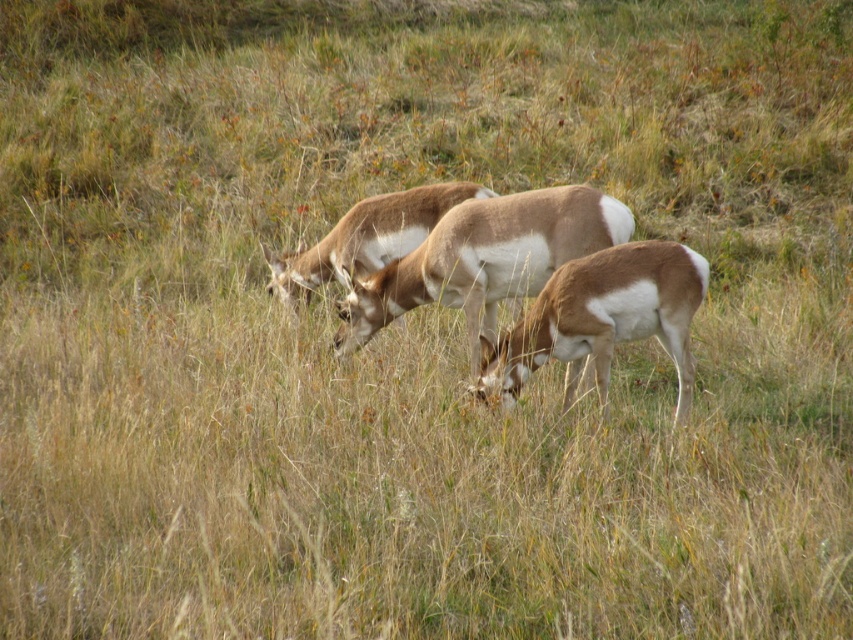
Which is behind, point (595, 196) or point (428, 232)?

The point (428, 232) is behind.

Which is in front, point (502, 278) or point (364, 202)?

Point (502, 278) is more forward.

You are a GUI agent. You are given a task and a screenshot of the screen. Output one action in this format:
    pyautogui.click(x=<x>, y=<y>)
    Task: Click on the brown speckled antelope at center
    
    Given the screenshot: What is the action you would take?
    pyautogui.click(x=485, y=259)

Between brown velvet antelope at center and brown fur antelope at center, which one has less height?

brown fur antelope at center

Is brown velvet antelope at center behind brown fur antelope at center?

No, brown velvet antelope at center is in front of brown fur antelope at center.

Where is `brown velvet antelope at center`? This screenshot has height=640, width=853. brown velvet antelope at center is located at coordinates (602, 317).

Measure the distance between brown speckled antelope at center and brown velvet antelope at center.

20.26 inches

Looking at this image, is brown speckled antelope at center shorter than brown velvet antelope at center?

Incorrect, brown speckled antelope at center's height does not fall short of brown velvet antelope at center's.

Is point (372, 284) closer to viewer compared to point (567, 362)?

No, it is not.

Identify the location of brown speckled antelope at center. (485, 259).